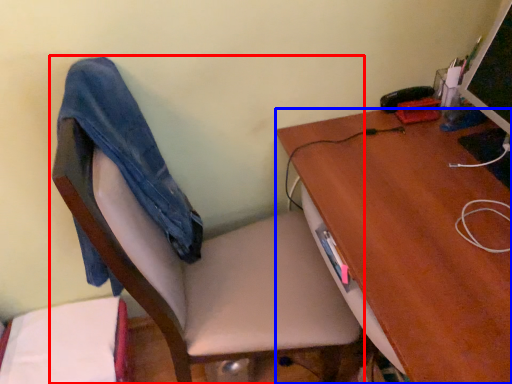
Question: Which object is further to the camera taking this photo, chair (highlighted by a red box) or desk (highlighted by a blue box)?

Choices:
 (A) chair
 (B) desk

Answer: (B)